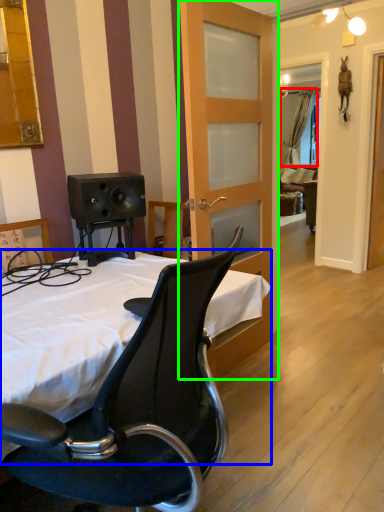
Question: Which object is the farthest from curtain (highlighted by a red box)? Choose among these: bed (highlighted by a blue box) or door (highlighted by a green box).

Choices:
 (A) bed
 (B) door

Answer: (A)